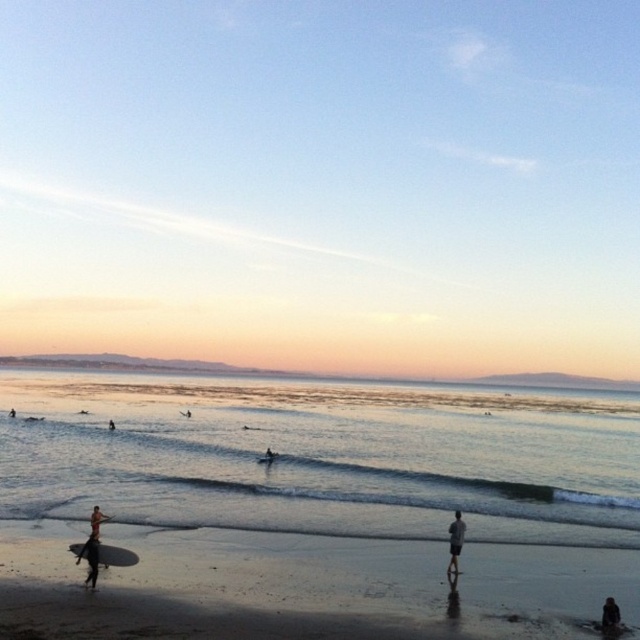
Question: Which point is closer to the camera taking this photo?

Choices:
 (A) (115, 550)
 (B) (12, 406)
 (C) (244, 634)
 (D) (109, 420)

Answer: (C)

Question: Which point is farther to the camera?

Choices:
 (A) dark fabric figure at lower right
 (B) brown surfboard at lower left
 (C) white matte surfboard at lower left

Answer: (B)

Question: Does smooth sand at lower center have a smaller size compared to dark gray fabric shorts at center?

Choices:
 (A) yes
 (B) no

Answer: (B)

Question: Which of the following is the farthest from the observer?

Choices:
 (A) clear blue water at center
 (B) dark fabric figure at lower right
 (C) dark blue wetsuit at center

Answer: (C)

Question: Can you confirm if smooth sand at lower center is bigger than dark blue wetsuit at center?

Choices:
 (A) no
 (B) yes

Answer: (B)

Question: Can you confirm if dark gray wetsuit at lower left is positioned above dark blue wetsuit at center?

Choices:
 (A) yes
 (B) no

Answer: (A)